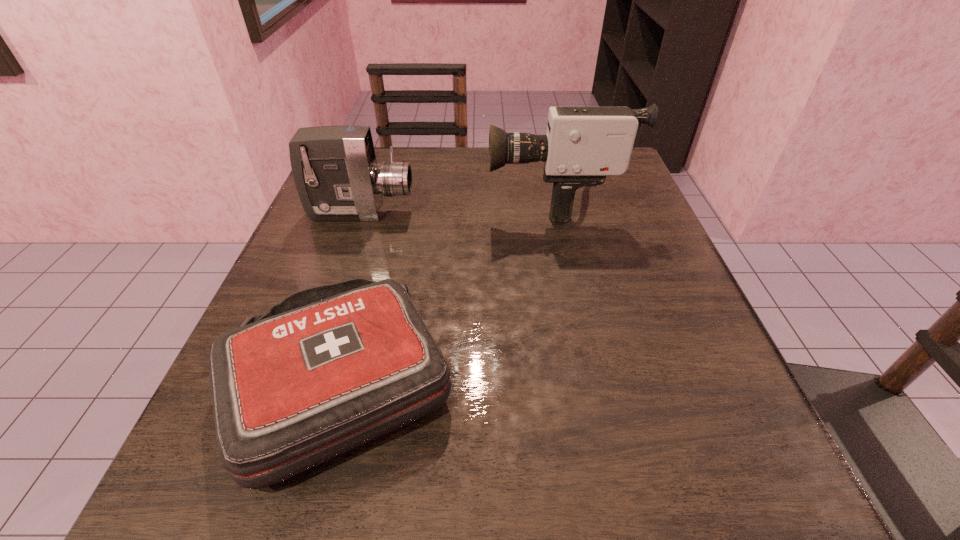
The image size is (960, 540). In the image, there is a desktop. Find the location of `vacant space at the left edge`. vacant space at the left edge is located at coordinates (338, 224).

Identify the location of free space at the right edge of the desktop. This screenshot has height=540, width=960. (646, 211).

This screenshot has width=960, height=540. Find the location of `free space at the far left corner`. free space at the far left corner is located at coordinates (389, 159).

Locate an element on the screen. vacant area at the near right corner of the desktop is located at coordinates (789, 517).

At what (x,y) coordinates should I click in order to perform the action: click on vacant space that's between the first-aid kit and the rightmost object. Please return your answer as a coordinate pair (x, y). Looking at the image, I should click on (448, 291).

The height and width of the screenshot is (540, 960). Find the location of `free space between the taller camcorder and the left camcorder`. free space between the taller camcorder and the left camcorder is located at coordinates (458, 206).

Locate an element on the screen. This screenshot has width=960, height=540. free spot between the right camcorder and the second shortest object is located at coordinates [458, 206].

Where is `empty space between the rightmost object and the shortest object`? This screenshot has width=960, height=540. empty space between the rightmost object and the shortest object is located at coordinates (448, 291).

Image resolution: width=960 pixels, height=540 pixels. In order to click on empty space between the shorter camcorder and the rightmost object in this screenshot , I will do `click(458, 206)`.

The image size is (960, 540). In order to click on free space that is in between the second tallest object and the tallest object in this screenshot , I will do `click(458, 206)`.